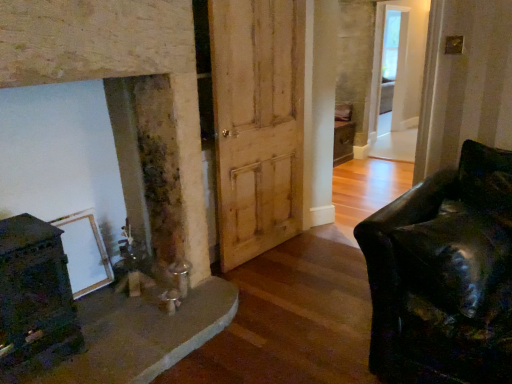
Question: Would you say clear glass door at upper right is inside or outside natural wood barn door at center?

Choices:
 (A) inside
 (B) outside

Answer: (B)

Question: In terms of size, does clear glass door at upper right appear bigger or smaller than natural wood barn door at center?

Choices:
 (A) big
 (B) small

Answer: (A)

Question: Would you say clear glass door at upper right is to the left or to the right of natural wood barn door at center in the picture?

Choices:
 (A) right
 (B) left

Answer: (A)

Question: Based on their sizes in the image, would you say natural wood barn door at center is bigger or smaller than clear glass door at upper right?

Choices:
 (A) small
 (B) big

Answer: (A)

Question: In terms of height, does natural wood barn door at center look taller or shorter compared to clear glass door at upper right?

Choices:
 (A) short
 (B) tall

Answer: (A)

Question: From a real-world perspective, is natural wood barn door at center above or below clear glass door at upper right?

Choices:
 (A) above
 (B) below

Answer: (B)

Question: Does point (236, 28) appear closer or farther from the camera than point (403, 26)?

Choices:
 (A) closer
 (B) farther

Answer: (A)